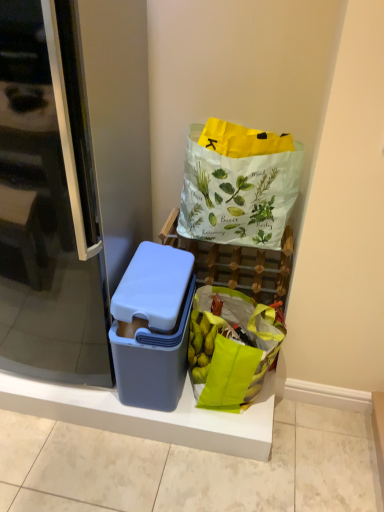
Where is `vacant space that is in between green fabric grocery bag at lower right and matte plastic lunch box at center`? This screenshot has height=512, width=384. vacant space that is in between green fabric grocery bag at lower right and matte plastic lunch box at center is located at coordinates (217, 420).